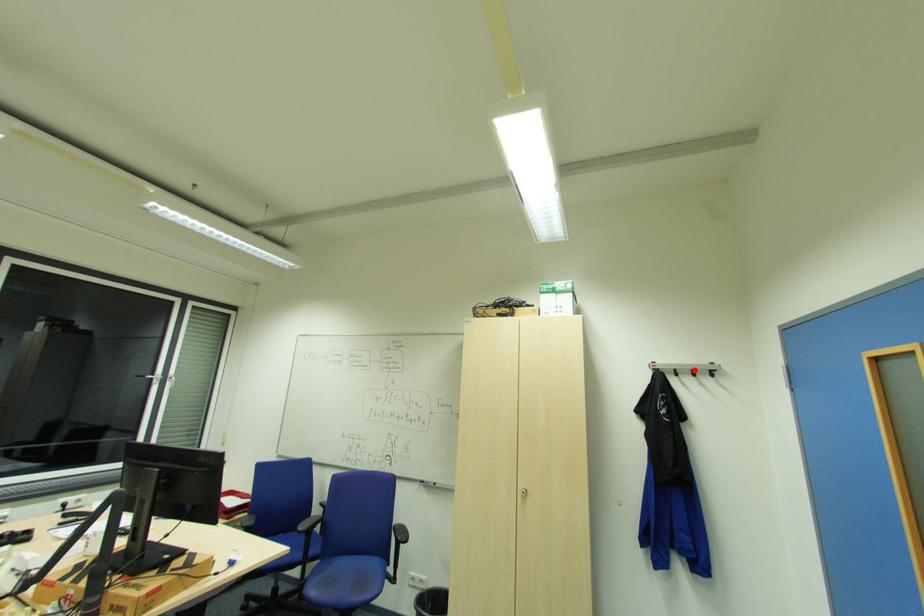
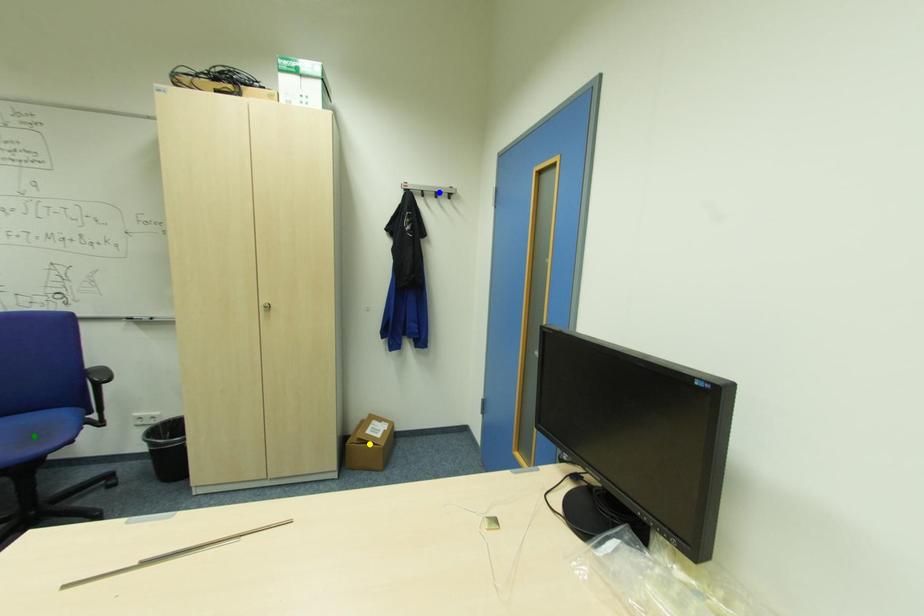
Question: I am providing you with two images of the same scene from different viewpoints. A red point is marked on the first image. You are given multiple points on the second image. In image 2, which mark is for the same physical point as the one in image 1?

Choices:
 (A) green point
 (B) blue point
 (C) yellow point

Answer: (B)